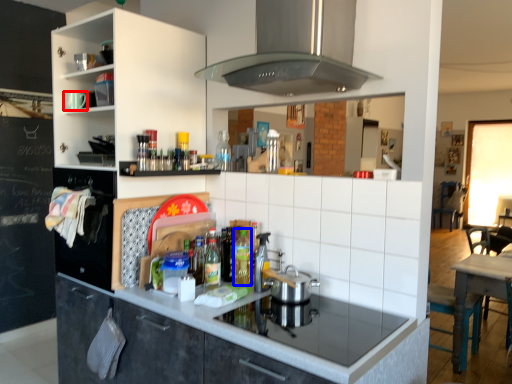
Question: Which point is further to the camera, appliance (highlighted by a red box) or bottle (highlighted by a blue box)?

Choices:
 (A) appliance
 (B) bottle

Answer: (A)